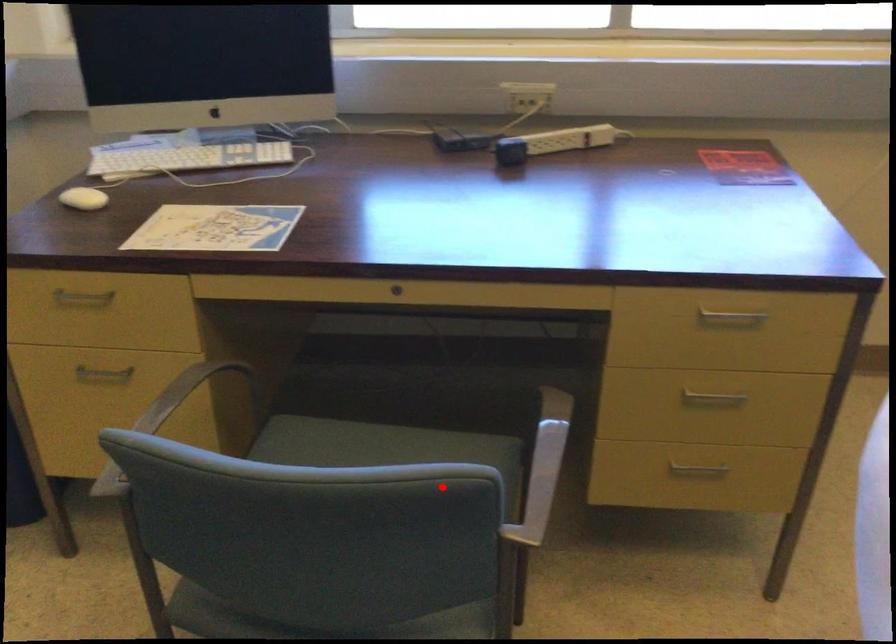
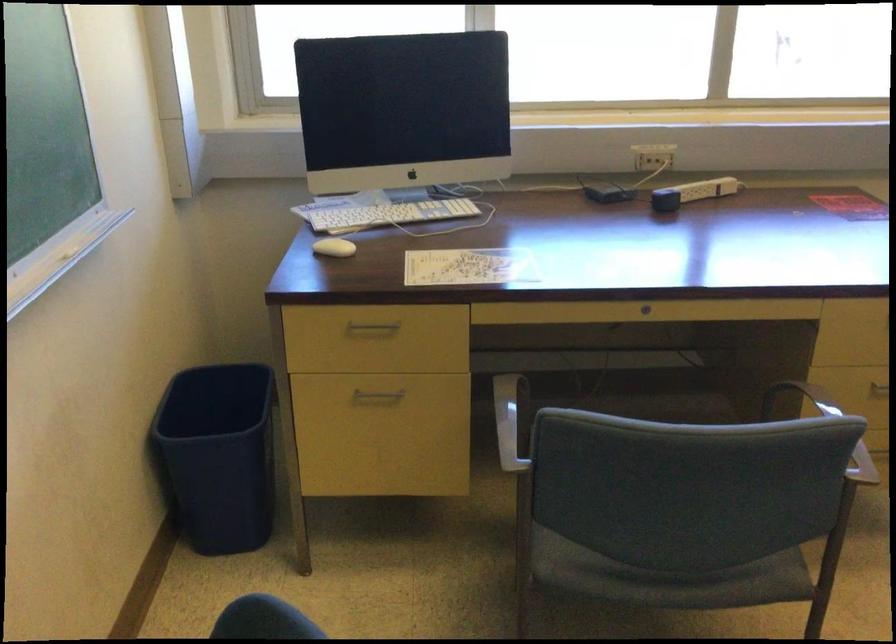
Locate, in the second image, the point that corresponds to the highlighted location in the first image.

(825, 427)